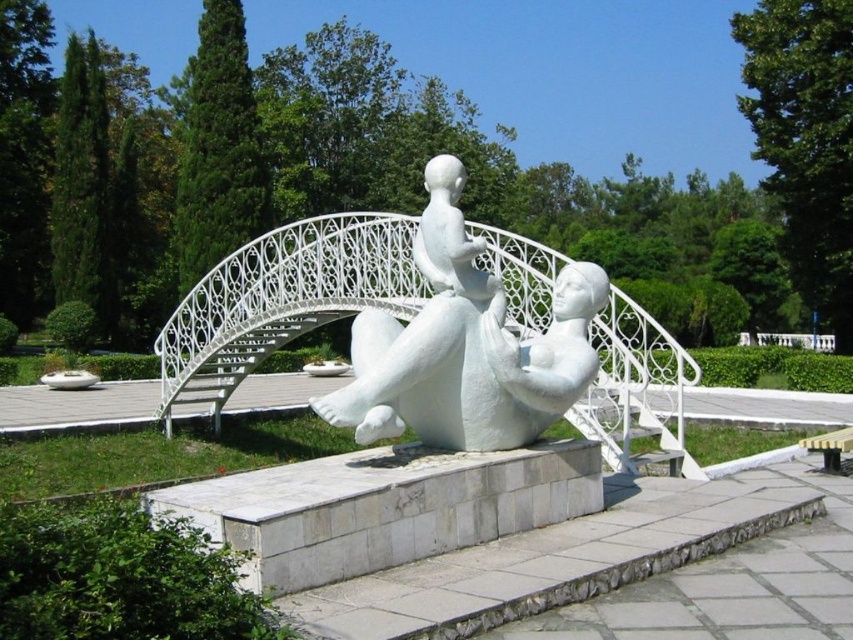
Is white wrought iron bridge at center in front of white marble sculpture at center?

Yes, white wrought iron bridge at center is closer to the viewer.

Is white wrought iron bridge at center thinner than white marble sculpture at center?

No, white wrought iron bridge at center is not thinner than white marble sculpture at center.

Which is behind, point (171, 401) or point (444, 209)?

The point (171, 401) is more distant.

Image resolution: width=853 pixels, height=640 pixels. In order to click on white wrought iron bridge at center in this screenshot , I will do `click(282, 300)`.